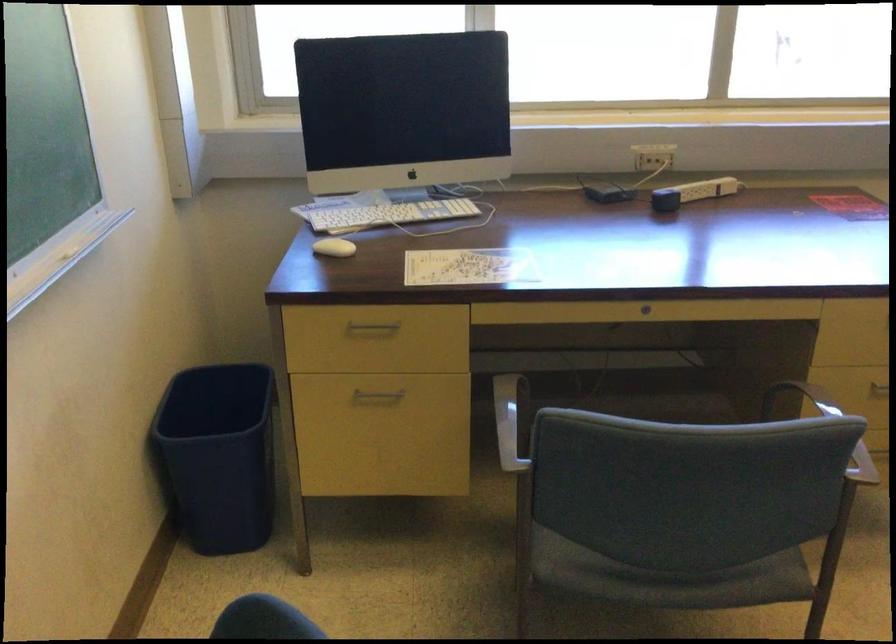
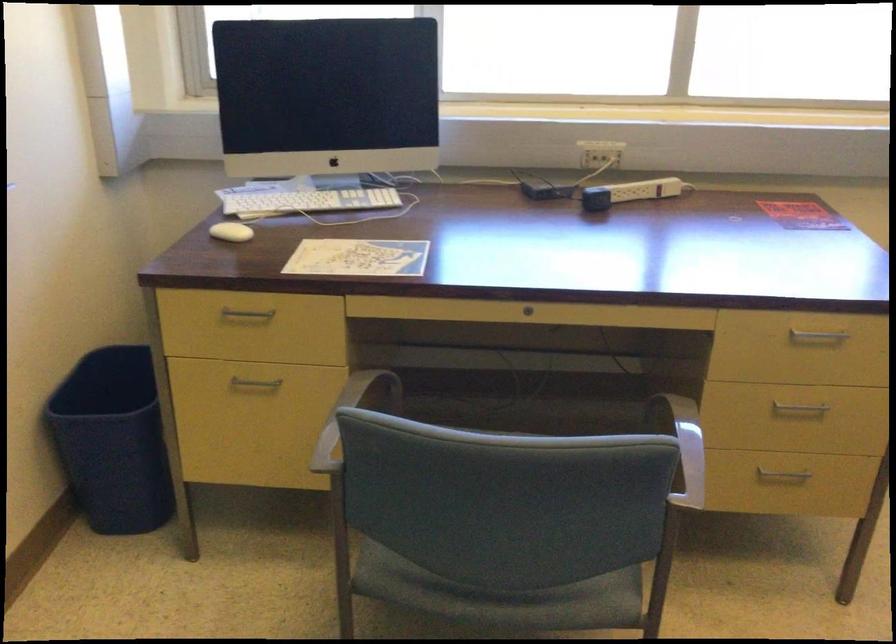
The point at [382,212] is marked in the first image. Where is the corresponding point in the second image?

(304, 200)